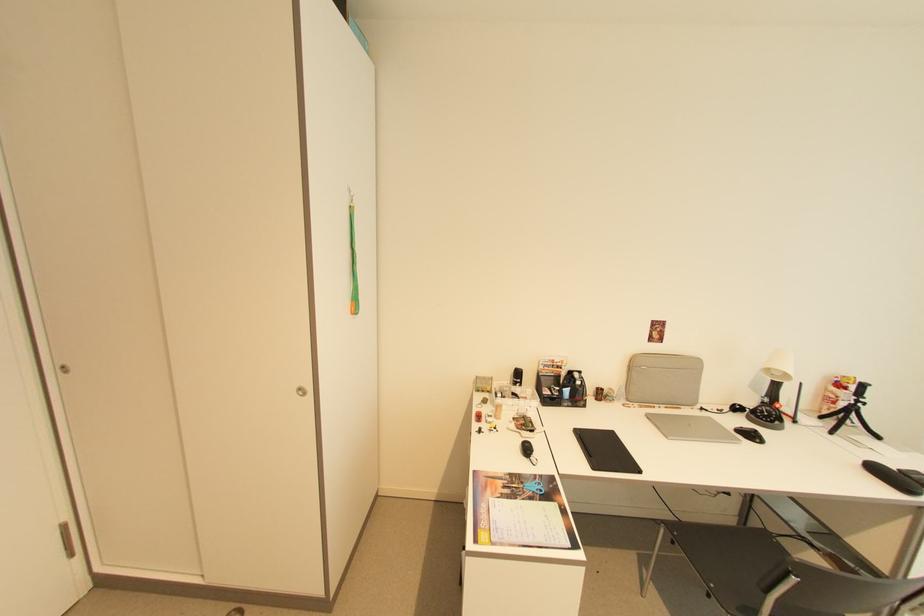
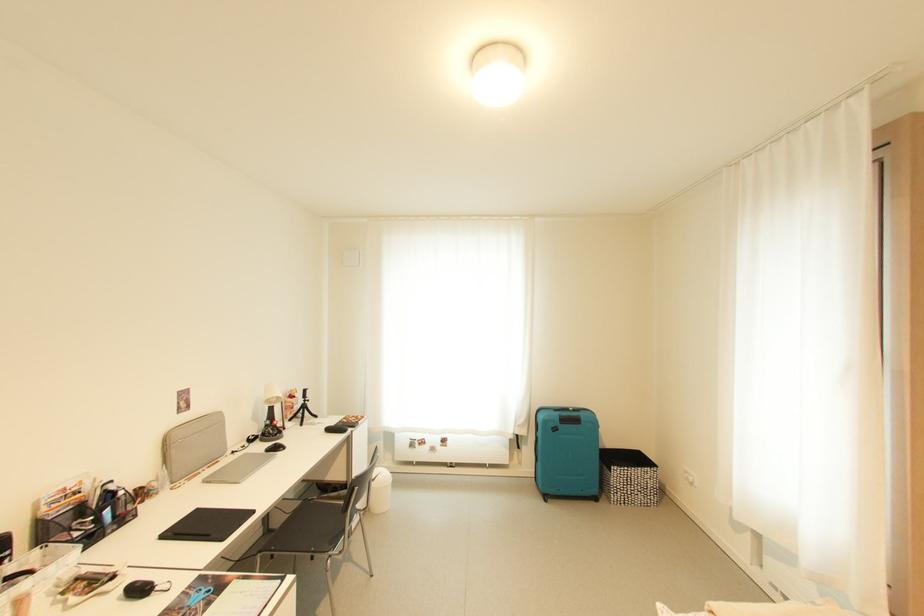
Where in the second image is the point corresponding to [756,437] from the first image?

(282, 450)